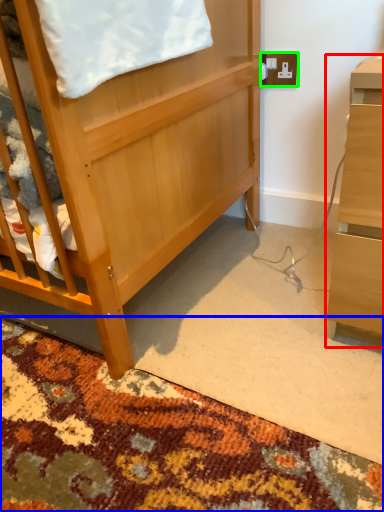
Question: Which object is the farthest from desk (highlighted by a red box)? Choose among these: mat (highlighted by a blue box) or electric outlet (highlighted by a green box).

Choices:
 (A) mat
 (B) electric outlet

Answer: (B)